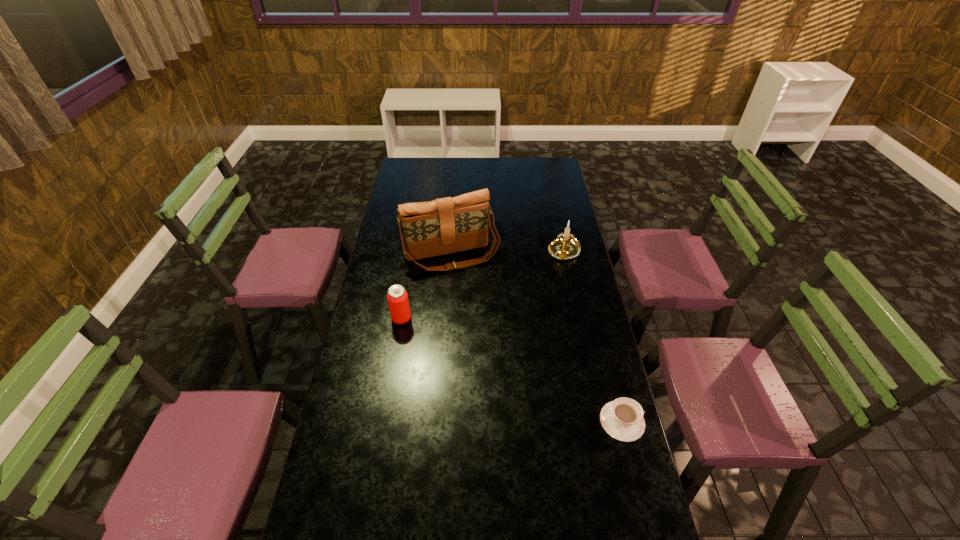
Identify the location of vacant area that lies between the third farthest object and the candle holder. (483, 285).

This screenshot has width=960, height=540. I want to click on vacant area that lies between the second nearest object and the nearest object, so click(512, 370).

Identify the location of unoccupied position between the shortest object and the candle holder. The width and height of the screenshot is (960, 540). (593, 336).

I want to click on vacant area that lies between the beer can and the candle holder, so click(483, 285).

The height and width of the screenshot is (540, 960). What are the coordinates of `vacant area that lies between the third farthest object and the candle holder` in the screenshot? It's located at (483, 285).

Image resolution: width=960 pixels, height=540 pixels. What are the coordinates of `blank region between the tallest object and the beer can` in the screenshot? It's located at (426, 287).

The height and width of the screenshot is (540, 960). What are the coordinates of `vacant region between the third farthest object and the candle holder` in the screenshot? It's located at (483, 285).

Where is `empty space between the third farthest object and the shoulder bag`? empty space between the third farthest object and the shoulder bag is located at coordinates (426, 287).

Locate an element on the screen. This screenshot has width=960, height=540. vacant area that lies between the teacup and the tallest object is located at coordinates (537, 339).

At what (x,y) coordinates should I click in order to perform the action: click on vacant space that's between the candle holder and the beer can. Please return your answer as a coordinate pair (x, y). Looking at the image, I should click on (483, 285).